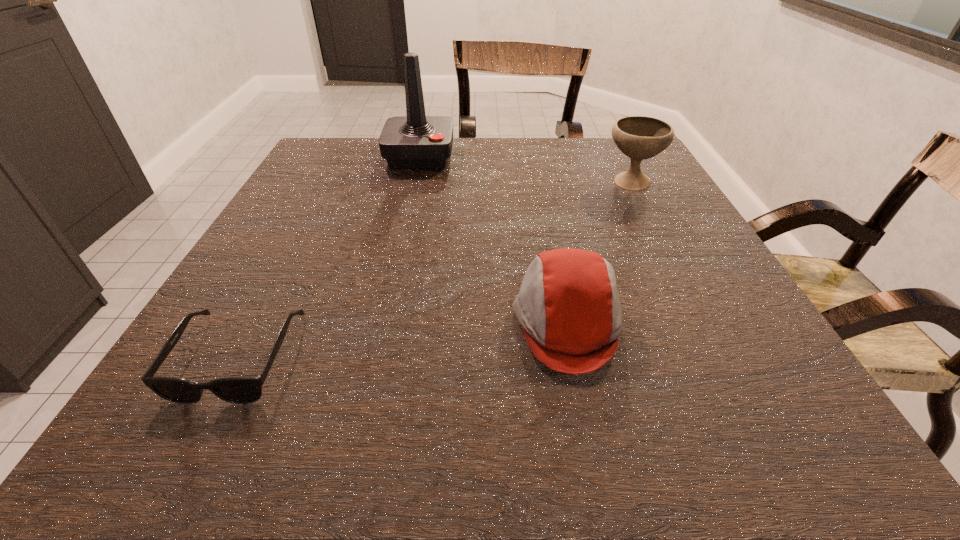
You are a GUI agent. You are given a task and a screenshot of the screen. Output one action in this format:
    pyautogui.click(x=<x>, y=<y>)
    Task: Click on the free space between the tallest object and the shortest object
    The height and width of the screenshot is (540, 960).
    Given the screenshot: What is the action you would take?
    pyautogui.click(x=329, y=256)

Where is `empty location between the tallest object and the third shortest object`? Image resolution: width=960 pixels, height=540 pixels. empty location between the tallest object and the third shortest object is located at coordinates (525, 170).

Where is `free area in between the tallest object and the chalice`? free area in between the tallest object and the chalice is located at coordinates (525, 170).

Locate an element on the screen. Image resolution: width=960 pixels, height=540 pixels. free space that is in between the second tallest object and the second object from right to left is located at coordinates pos(599,253).

Image resolution: width=960 pixels, height=540 pixels. I want to click on vacant area that lies between the tallest object and the second object from right to left, so click(x=493, y=239).

This screenshot has width=960, height=540. Identify the location of unoccupied position between the tallest object and the sunglasses. (329, 256).

Image resolution: width=960 pixels, height=540 pixels. What are the coordinates of `vacant region between the chalice and the cap` in the screenshot? It's located at (599, 253).

You are a GUI agent. You are given a task and a screenshot of the screen. Output one action in this format:
    pyautogui.click(x=<x>, y=<y>)
    Task: Click on the empty location between the joystick and the second tallest object
    This screenshot has height=540, width=960.
    Given the screenshot: What is the action you would take?
    (x=525, y=170)

This screenshot has height=540, width=960. I want to click on the third closest object to the chalice, so click(241, 390).

Identify which object is the second nearest to the second tallest object. Please provide its 2D coordinates. Your answer should be formatted as a tuple, i.e. [(x, y)], where the tuple contains the x and y coordinates of a point satisfying the conditions above.

[(416, 141)]